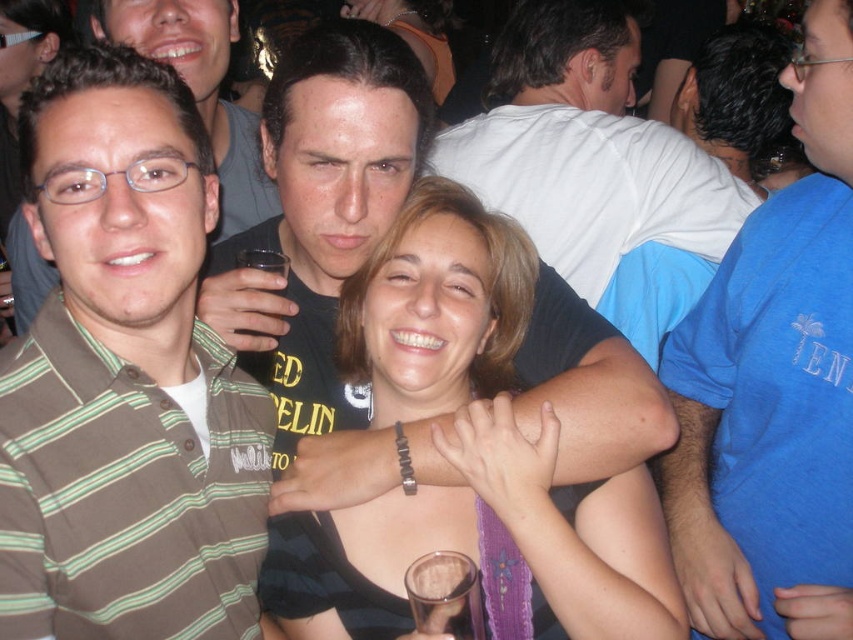
Looking at the image of the social gathering, which object is smaller between the black matte shirt at center and the white cotton shirt at upper center?

The black matte shirt at center is smaller than the white cotton shirt at upper center.